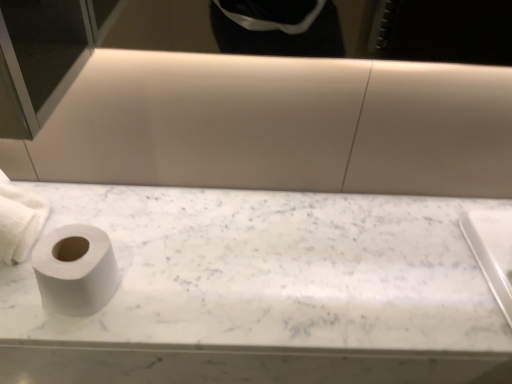
Question: Considering the relative positions of white matte toilet paper at left, the second toilet paper from the right, and white marble toilet paper at left in the image provided, is white matte toilet paper at left, the second toilet paper from the right, to the right of white marble toilet paper at left from the viewer's perspective?

Choices:
 (A) yes
 (B) no

Answer: (B)

Question: Is white matte toilet paper at left, the second toilet paper from the right, facing away from white marble toilet paper at left?

Choices:
 (A) yes
 (B) no

Answer: (B)

Question: From a real-world perspective, is white matte toilet paper at left, the second toilet paper from the right, below white marble toilet paper at left?

Choices:
 (A) no
 (B) yes

Answer: (A)

Question: From the image's perspective, is white matte toilet paper at left, the second toilet paper from the right, beneath white marble toilet paper at left?

Choices:
 (A) yes
 (B) no

Answer: (B)

Question: Does white matte toilet paper at left, the second toilet paper from the right, have a greater height compared to white marble toilet paper at left?

Choices:
 (A) no
 (B) yes

Answer: (B)

Question: Does white matte toilet paper at left, the second toilet paper from the right, have a greater width compared to white marble toilet paper at left?

Choices:
 (A) no
 (B) yes

Answer: (A)

Question: Can you confirm if white marble toilet paper at left is bigger than white matte toilet paper at left, which appears as the 1th toilet paper when viewed from the right?

Choices:
 (A) no
 (B) yes

Answer: (B)

Question: From the image's perspective, is white marble toilet paper at left below white matte toilet paper at left, the second toilet paper in the left-to-right sequence?

Choices:
 (A) yes
 (B) no

Answer: (A)

Question: Is white marble toilet paper at left positioned beyond the bounds of white matte toilet paper at left, which appears as the 1th toilet paper when viewed from the right?

Choices:
 (A) yes
 (B) no

Answer: (A)

Question: Is white matte toilet paper at left, which appears as the 1th toilet paper when viewed from the right, surrounded by white marble toilet paper at left?

Choices:
 (A) no
 (B) yes

Answer: (A)

Question: Is white marble toilet paper at left smaller than white matte toilet paper at left, the second toilet paper in the left-to-right sequence?

Choices:
 (A) yes
 (B) no

Answer: (B)

Question: Considering the relative sizes of white marble toilet paper at left and white matte toilet paper at left, which appears as the 1th toilet paper when viewed from the right, in the image provided, is white marble toilet paper at left shorter than white matte toilet paper at left, which appears as the 1th toilet paper when viewed from the right,?

Choices:
 (A) yes
 (B) no

Answer: (A)

Question: Could white marble toilet paper at left be considered to be inside white matte toilet paper at left, the second toilet paper in the left-to-right sequence?

Choices:
 (A) yes
 (B) no

Answer: (B)